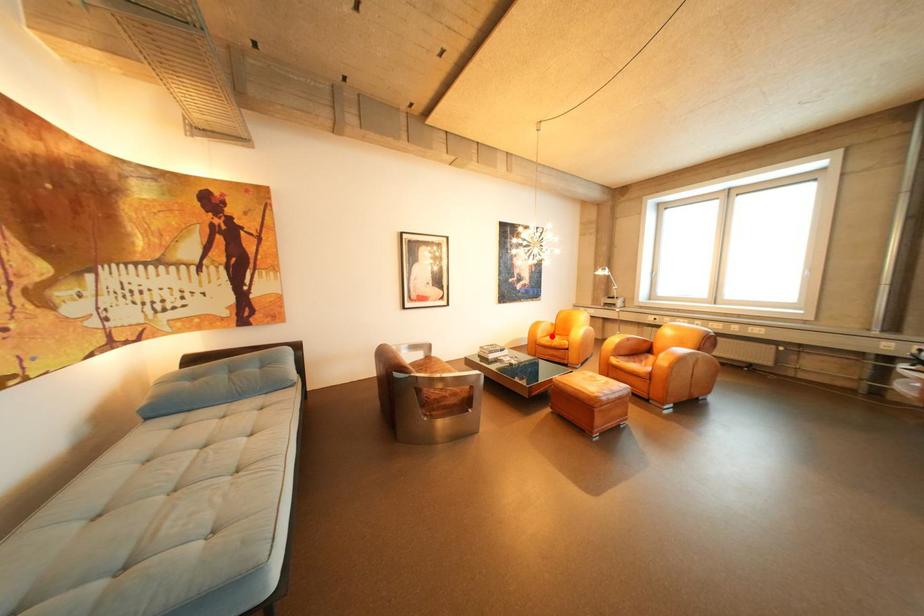
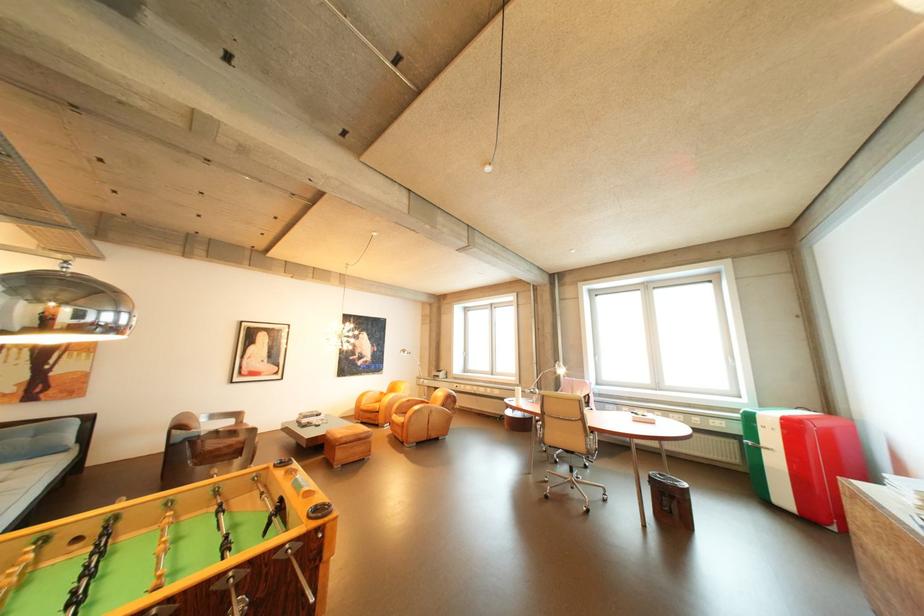
Locate, in the second image, the point that corresponds to the highlighted location in the first image.

(377, 403)